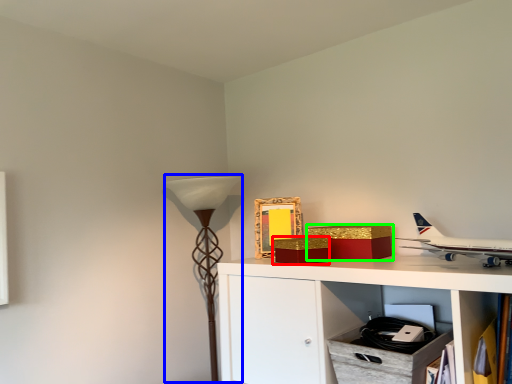
Question: Estimate the real-world distances between objects in this image. Which object is farther from box (highlighted by a red box), table lamp (highlighted by a blue box) or box (highlighted by a green box)?

Choices:
 (A) table lamp
 (B) box

Answer: (A)